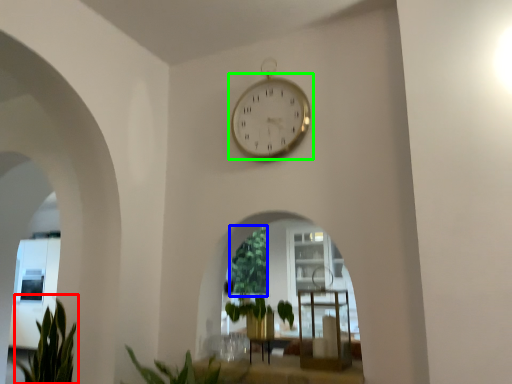
Question: Which object is the farthest from plant (highlighted by a red box)? Choose among these: vegetation (highlighted by a blue box) or wall clock (highlighted by a green box).

Choices:
 (A) vegetation
 (B) wall clock

Answer: (B)